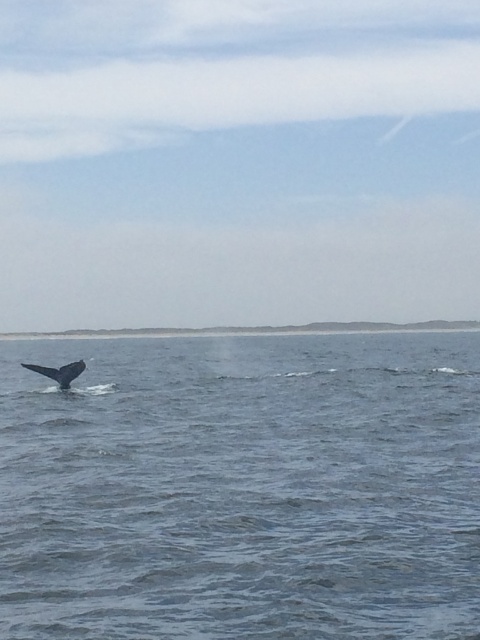
Question: Is blue water at lower left thinner than gray matte whale tail at lower left?

Choices:
 (A) yes
 (B) no

Answer: (B)

Question: In this image, where is blue water at lower left located relative to gray matte whale tail at lower left?

Choices:
 (A) left
 (B) right

Answer: (B)

Question: Which point is farther to the camera?

Choices:
 (A) gray matte whale tail at lower left
 (B) blue water at lower left

Answer: (A)

Question: Which point appears closest to the camera in this image?

Choices:
 (A) (232, 536)
 (B) (61, 371)

Answer: (A)

Question: Can you confirm if blue water at lower left is positioned to the left of gray matte whale tail at lower left?

Choices:
 (A) yes
 (B) no

Answer: (B)

Question: Which point is closer to the camera?

Choices:
 (A) (199, 628)
 (B) (41, 371)

Answer: (A)